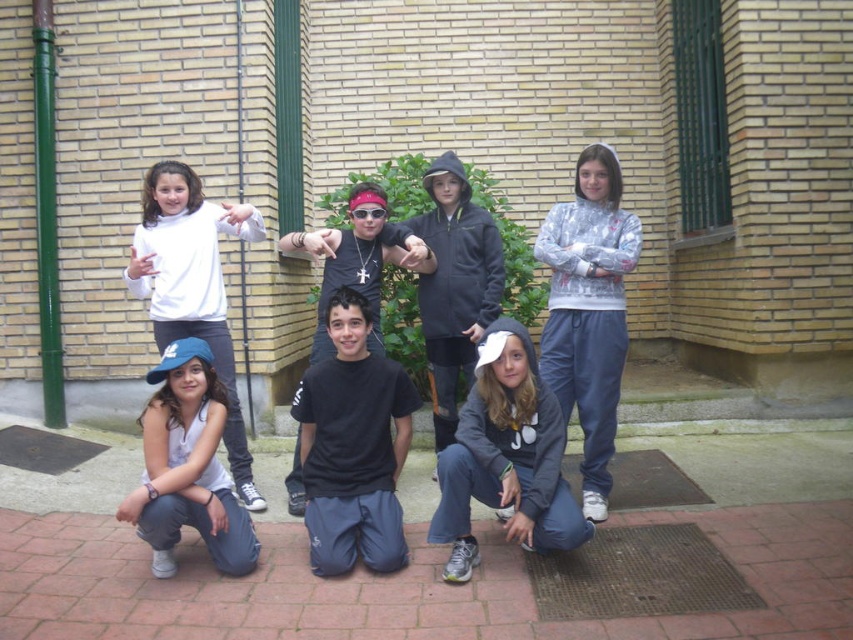
You are a photographer trying to capture a group photo of the children. You notice the gray fleece hoodie at right and the white fabric tank top at lower left. Which clothing item should you adjust to ensure both are visible in the frame?

The gray fleece hoodie at right is taller than the white fabric tank top at lower left. To ensure both are visible, you should adjust the angle or position so that the taller gray fleece hoodie at right does not block the view of the shorter white fabric tank top at lower left.

You are standing in front of the brick wall and see the point marked at coordinates (352,445). What object is located at that point?

The point at coordinates (352,445) marks the location of the black matte t shirt at center.